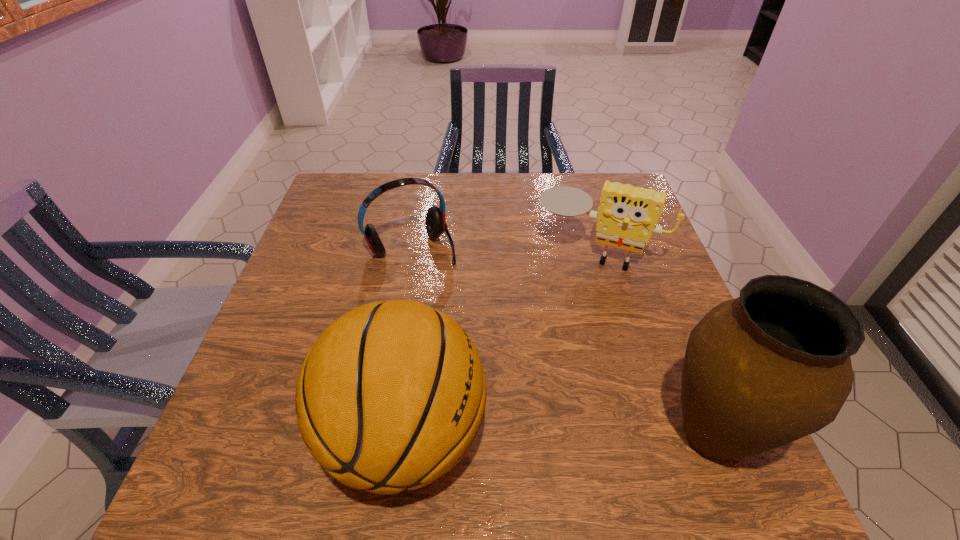
This screenshot has width=960, height=540. In order to click on vacant space located 0.060m on the front-facing side of the sponge in this screenshot , I will do `click(571, 288)`.

The image size is (960, 540). In order to click on free space located 0.140m with the microphone attached to the side of the headset in this screenshot , I will do `click(452, 300)`.

Locate an element on the screen. The image size is (960, 540). free location located with the microphone attached to the side of the headset is located at coordinates click(452, 300).

I want to click on vacant space located with the microphone attached to the side of the headset, so click(483, 349).

Locate an element on the screen. This screenshot has width=960, height=540. basketball situated at the near edge is located at coordinates (391, 396).

Find the location of a particular element. This screenshot has width=960, height=540. urn situated at the near edge is located at coordinates (772, 366).

The image size is (960, 540). I want to click on urn that is at the right edge, so click(772, 366).

This screenshot has height=540, width=960. I want to click on sponge that is at the right edge, so click(627, 216).

Where is `object at the near right corner`? This screenshot has width=960, height=540. object at the near right corner is located at coordinates (772, 366).

This screenshot has width=960, height=540. Find the location of `free spot at the far edge of the desktop`. free spot at the far edge of the desktop is located at coordinates (509, 208).